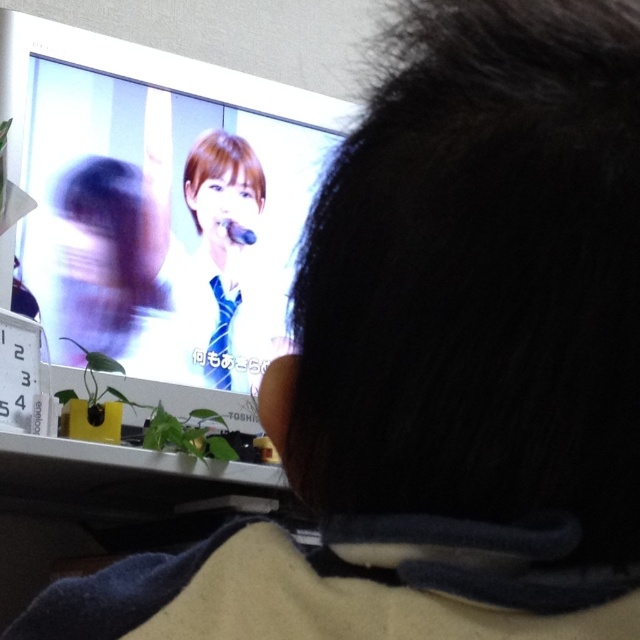
Question: Is white glossy monitor at upper center wider than blue silk tie at center?

Choices:
 (A) no
 (B) yes

Answer: (B)

Question: Does white glossy monitor at upper center have a lesser width compared to blue silk tie at center?

Choices:
 (A) yes
 (B) no

Answer: (B)

Question: Which of the following is the farthest from the observer?

Choices:
 (A) (65, 236)
 (B) (211, 348)

Answer: (B)

Question: Is white glossy monitor at upper center positioned at the back of blue silk tie at center?

Choices:
 (A) no
 (B) yes

Answer: (A)

Question: Which of the following is the closest to the observer?

Choices:
 (A) (93, 186)
 (B) (211, 376)

Answer: (A)

Question: Which object is farther from the camera taking this photo?

Choices:
 (A) white glossy monitor at upper center
 (B) blue silk tie at center

Answer: (B)